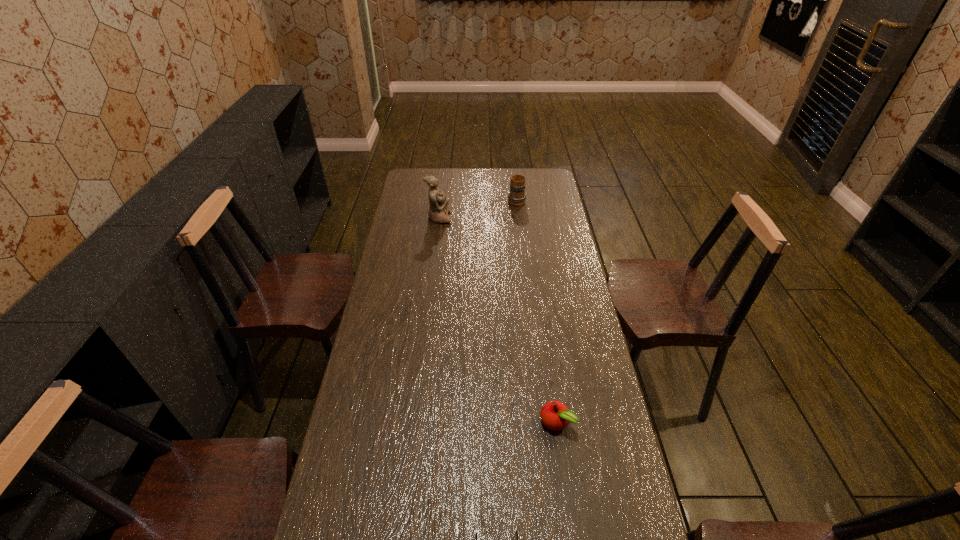
This screenshot has width=960, height=540. I want to click on object that can be found as the closest to the third shortest object, so click(x=438, y=203).

Where is `object that stands as the second closest to the third nearest object`? The height and width of the screenshot is (540, 960). object that stands as the second closest to the third nearest object is located at coordinates [x=555, y=415].

Where is `blank area in the image that satisfies the following two spatial constraints: 1. on the front-facing side of the second nearest object; 2. on the right side of the second farthest object`? The height and width of the screenshot is (540, 960). blank area in the image that satisfies the following two spatial constraints: 1. on the front-facing side of the second nearest object; 2. on the right side of the second farthest object is located at coordinates (414, 422).